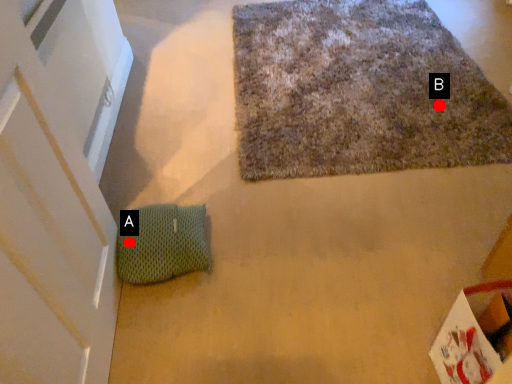
Question: Two points are circled on the image, labeled by A and B beside each circle. Among these points, which one is nearest to the camera?

Choices:
 (A) A is closer
 (B) B is closer

Answer: (A)